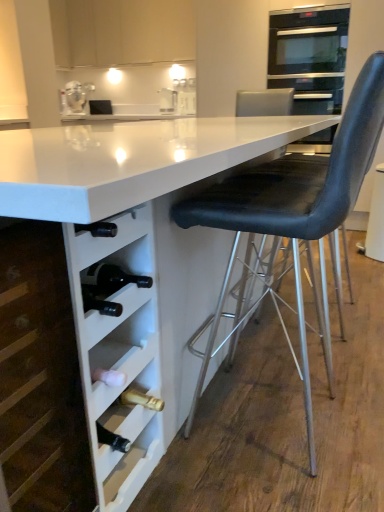
Question: Is black leather chair at right not inside clear glass jar at upper left?

Choices:
 (A) yes
 (B) no

Answer: (A)

Question: From the image's perspective, is black leather chair at right located beneath clear glass jar at upper left?

Choices:
 (A) no
 (B) yes

Answer: (B)

Question: Considering the relative sizes of black leather chair at right and clear glass jar at upper left in the image provided, is black leather chair at right bigger than clear glass jar at upper left?

Choices:
 (A) yes
 (B) no

Answer: (A)

Question: Does black leather chair at right turn towards clear glass jar at upper left?

Choices:
 (A) yes
 (B) no

Answer: (B)

Question: From the image's perspective, would you say black leather chair at right is positioned over clear glass jar at upper left?

Choices:
 (A) no
 (B) yes

Answer: (A)

Question: From the image's perspective, relative to white matte cabinet at upper center, the 1th cabinetry viewed from the top, is white matte wine rack at lower left, placed as the 1th cabinetry when sorted from front to back, above or below?

Choices:
 (A) above
 (B) below

Answer: (B)

Question: Looking at the image, does white matte wine rack at lower left, the second cabinetry positioned from the top, seem bigger or smaller compared to white matte cabinet at upper center, placed as the 1th cabinetry when sorted from back to front?

Choices:
 (A) big
 (B) small

Answer: (B)

Question: From a real-world perspective, is white matte wine rack at lower left, placed as the 1th cabinetry when sorted from front to back, positioned above or below white matte cabinet at upper center, acting as the second cabinetry starting from the bottom?

Choices:
 (A) below
 (B) above

Answer: (A)

Question: Is white matte wine rack at lower left, placed as the 1th cabinetry when sorted from front to back, spatially inside white matte cabinet at upper center, the 1th cabinetry viewed from the top, or outside of it?

Choices:
 (A) inside
 (B) outside

Answer: (B)

Question: From the image's perspective, is black leather chair at right located above or below white glossy table at center?

Choices:
 (A) below
 (B) above

Answer: (A)

Question: In the image, is black leather chair at right on the left side or the right side of white glossy table at center?

Choices:
 (A) left
 (B) right

Answer: (B)

Question: Is black leather chair at right inside or outside of white glossy table at center?

Choices:
 (A) inside
 (B) outside

Answer: (A)

Question: In the image, is black leather chair at right positioned in front of or behind white glossy table at center?

Choices:
 (A) front
 (B) behind

Answer: (B)

Question: Is stainless steel oven at upper right inside the boundaries of black leather chair at right, or outside?

Choices:
 (A) inside
 (B) outside

Answer: (B)

Question: Considering the positions of stainless steel oven at upper right and black leather chair at right in the image, is stainless steel oven at upper right bigger or smaller than black leather chair at right?

Choices:
 (A) small
 (B) big

Answer: (A)